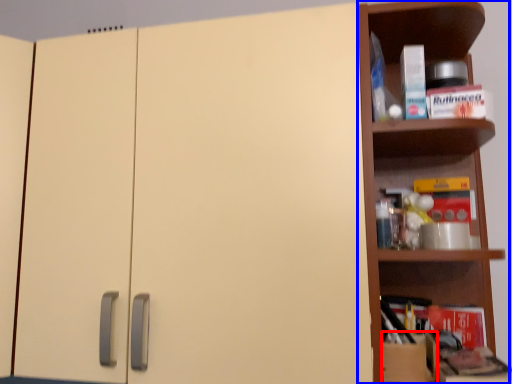
Question: Which of the following is the farthest to the observer, cardboard box (highlighted by a red box) or shelf (highlighted by a blue box)?

Choices:
 (A) cardboard box
 (B) shelf

Answer: (A)